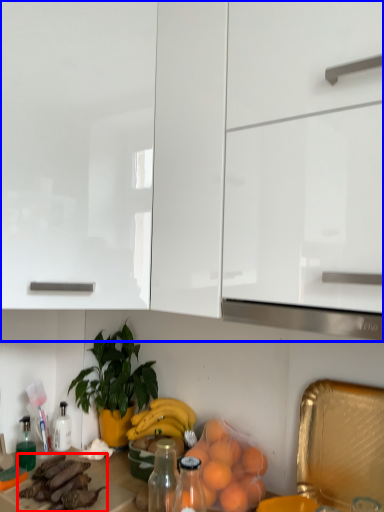
Question: Among these objects, which one is farthest to the camera, food (highlighted by a red box) or cabinetry (highlighted by a blue box)?

Choices:
 (A) food
 (B) cabinetry

Answer: (A)